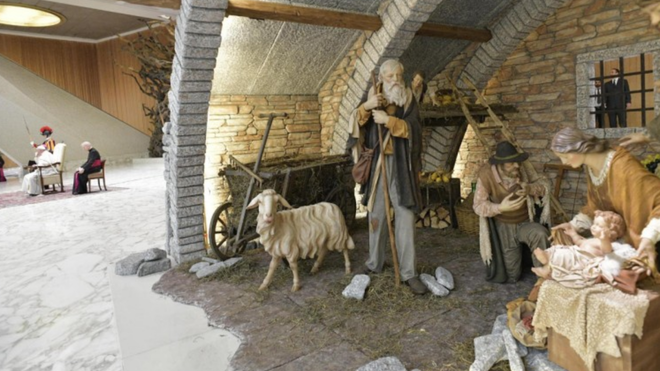
This screenshot has height=371, width=660. Find the location of `human figurines`. human figurines is located at coordinates (46, 156), (90, 161), (389, 177), (492, 188), (618, 180), (585, 244), (416, 88), (612, 97), (49, 142).